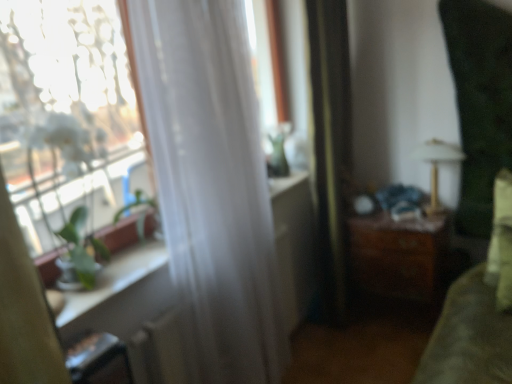
Question: From a real-world perspective, is metallic gold lamp at upper right located beneath wooden chest of drawers at center-right?

Choices:
 (A) yes
 (B) no

Answer: (B)

Question: From the image's perspective, is metallic gold lamp at upper right located above wooden chest of drawers at center-right?

Choices:
 (A) no
 (B) yes

Answer: (B)

Question: Would you say metallic gold lamp at upper right is a long distance from wooden chest of drawers at center-right?

Choices:
 (A) no
 (B) yes

Answer: (A)

Question: Does metallic gold lamp at upper right have a lesser width compared to wooden chest of drawers at center-right?

Choices:
 (A) yes
 (B) no

Answer: (A)

Question: Considering the relative sizes of metallic gold lamp at upper right and wooden chest of drawers at center-right in the image provided, is metallic gold lamp at upper right taller than wooden chest of drawers at center-right?

Choices:
 (A) no
 (B) yes

Answer: (A)

Question: Is point (288, 329) positioned closer to the camera than point (249, 215)?

Choices:
 (A) farther
 (B) closer

Answer: (A)

Question: Relative to white sheer curtain at left, marked as the first curtain in a left-to-right arrangement, is white sheer curtain at left in front or behind?

Choices:
 (A) behind
 (B) front

Answer: (A)

Question: Considering the positions of white sheer curtain at left and white sheer curtain at left, marked as the first curtain in a left-to-right arrangement, in the image, is white sheer curtain at left wider or thinner than white sheer curtain at left, marked as the first curtain in a left-to-right arrangement,?

Choices:
 (A) thin
 (B) wide

Answer: (A)

Question: In terms of height, does white sheer curtain at left look taller or shorter compared to white sheer curtain at left, positioned as the 2th curtain in right-to-left order?

Choices:
 (A) short
 (B) tall

Answer: (A)

Question: From a real-world perspective, is white sheer curtain at left, positioned as the 2th curtain in right-to-left order, above or below silky black curtain at center, positioned as the second curtain in left-to-right order?

Choices:
 (A) below
 (B) above

Answer: (B)

Question: From the image's perspective, is white sheer curtain at left, marked as the first curtain in a left-to-right arrangement, located above or below silky black curtain at center, positioned as the second curtain in left-to-right order?

Choices:
 (A) below
 (B) above

Answer: (A)

Question: Which is correct: white sheer curtain at left, positioned as the 2th curtain in right-to-left order, is inside silky black curtain at center, positioned as the second curtain in left-to-right order, or outside of it?

Choices:
 (A) outside
 (B) inside

Answer: (A)

Question: Is point pos(269,337) closer or farther from the camera than point pos(327,107)?

Choices:
 (A) closer
 (B) farther

Answer: (A)

Question: From their relative heights in the image, would you say white sheer curtain at left, positioned as the 2th curtain in right-to-left order, is taller or shorter than metallic gold lamp at upper right?

Choices:
 (A) tall
 (B) short

Answer: (A)

Question: In terms of width, does white sheer curtain at left, positioned as the 2th curtain in right-to-left order, look wider or thinner when compared to metallic gold lamp at upper right?

Choices:
 (A) wide
 (B) thin

Answer: (A)